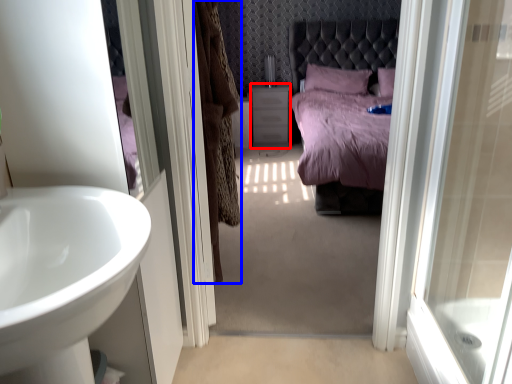
Question: Among these objects, which one is nearest to the camera, vanity (highlighted by a red box) or curtain (highlighted by a blue box)?

Choices:
 (A) vanity
 (B) curtain

Answer: (B)